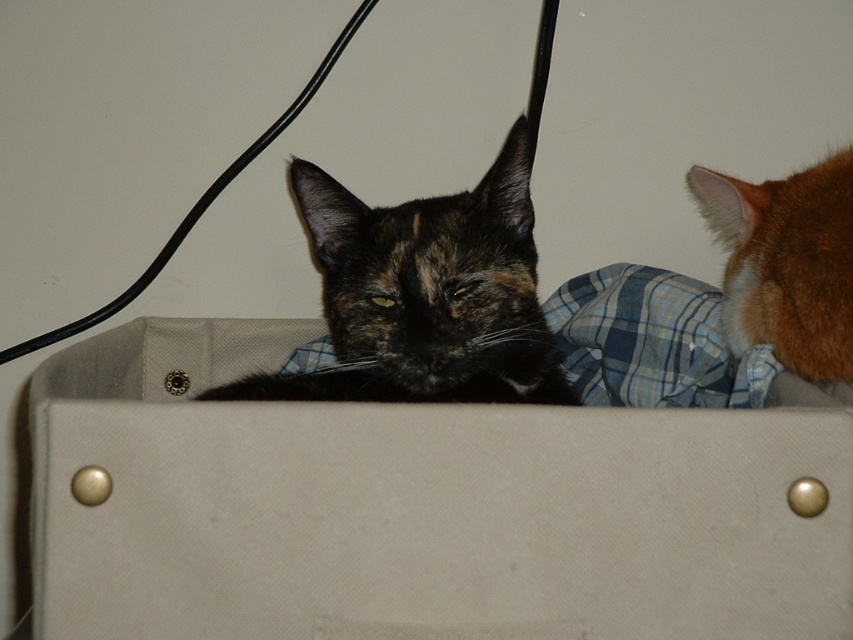
Is beige fabric box at center thinner than orange fur at upper right?

No.

In the scene shown: Measure the distance between beige fabric box at center and camera.

beige fabric box at center and camera are 33.82 inches apart from each other.

Where is `beige fabric box at center`? Image resolution: width=853 pixels, height=640 pixels. beige fabric box at center is located at coordinates (419, 506).

Does beige fabric box at center have a greater width compared to tortoiseshell fur cat at center?

Yes.

Does beige fabric box at center appear under tortoiseshell fur cat at center?

Yes.

This screenshot has width=853, height=640. I want to click on beige fabric box at center, so click(x=419, y=506).

Where is `beige fabric box at center`? The image size is (853, 640). beige fabric box at center is located at coordinates (419, 506).

In the scene shown: Can you confirm if tortoiseshell fur cat at center is shorter than orange fur at upper right?

Incorrect, tortoiseshell fur cat at center's height does not fall short of orange fur at upper right's.

Is tortoiseshell fur cat at center positioned at the back of orange fur at upper right?

No.

Identify the location of tortoiseshell fur cat at center. The width and height of the screenshot is (853, 640). click(x=424, y=294).